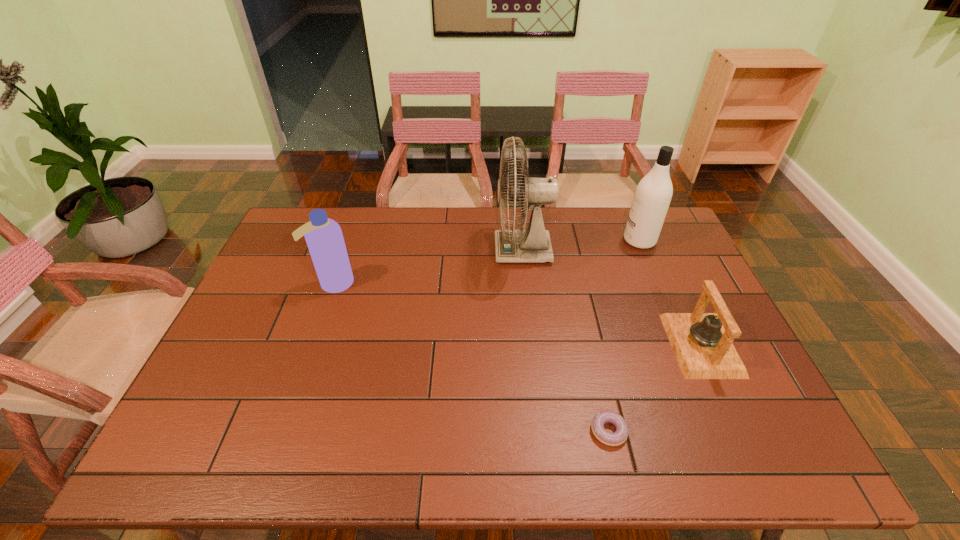
Where is `free spot between the right shampoo and the fourth tallest object`? free spot between the right shampoo and the fourth tallest object is located at coordinates (670, 293).

Where is `free space that is in between the bell and the fan`? The image size is (960, 540). free space that is in between the bell and the fan is located at coordinates (612, 298).

The width and height of the screenshot is (960, 540). What are the coordinates of `vacant space that's between the nearer shampoo and the doughnut` in the screenshot? It's located at (471, 357).

This screenshot has height=540, width=960. Identify the location of vacant space that is in between the bell and the left shampoo. (517, 314).

Locate an element on the screen. free space between the shorter shampoo and the fourth object from right to left is located at coordinates (428, 267).

The image size is (960, 540). In order to click on unoccupied position between the nearer shampoo and the nearest object in this screenshot , I will do `click(471, 357)`.

Identify the location of free space between the taller shampoo and the shorter shampoo. Image resolution: width=960 pixels, height=540 pixels. (487, 262).

Locate an element on the screen. The height and width of the screenshot is (540, 960). empty location between the leftmost object and the farther shampoo is located at coordinates (487, 262).

Image resolution: width=960 pixels, height=540 pixels. I want to click on object that is the closest to the farther shampoo, so click(533, 244).

Locate an element on the screen. object that ranks as the fourth closest to the third shortest object is located at coordinates (702, 343).